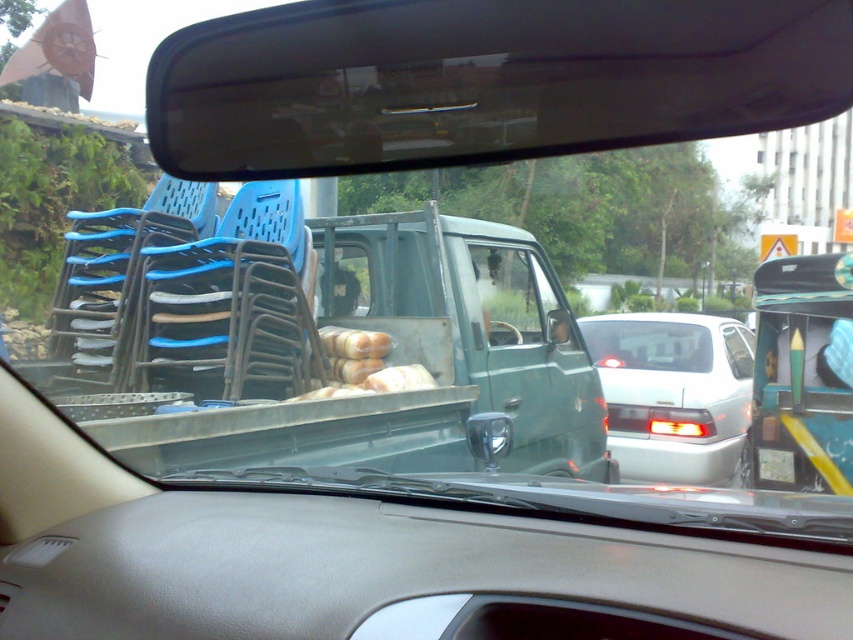
You are sitting in the driver seat of a car. You see a point at coordinate (395, 573). What object is located at that point?

The gray leather dashboard at center is located at the coordinate point (395, 573).

You are driving and want to adjust your rearview mirror to better see the road behind you. Since you can see both the gray leather dashboard at center and the green matte truck at center in your current view, which object is closer to you and might be blocking your view?

The gray leather dashboard at center is closer to the viewer than the green matte truck at center, so it might be blocking your view.

You are driving a car and need to adjust your rearview mirror to see both the gray leather dashboard at center and the silver metallic sedan at center properly. Since the dashboard is narrower than the sedan, which object will require a wider angle adjustment to ensure full visibility?

The silver metallic sedan at center requires a wider angle adjustment because its width is greater than the gray leather dashboard at center, necessitating a broader field of view to fully see it in the rearview mirror.